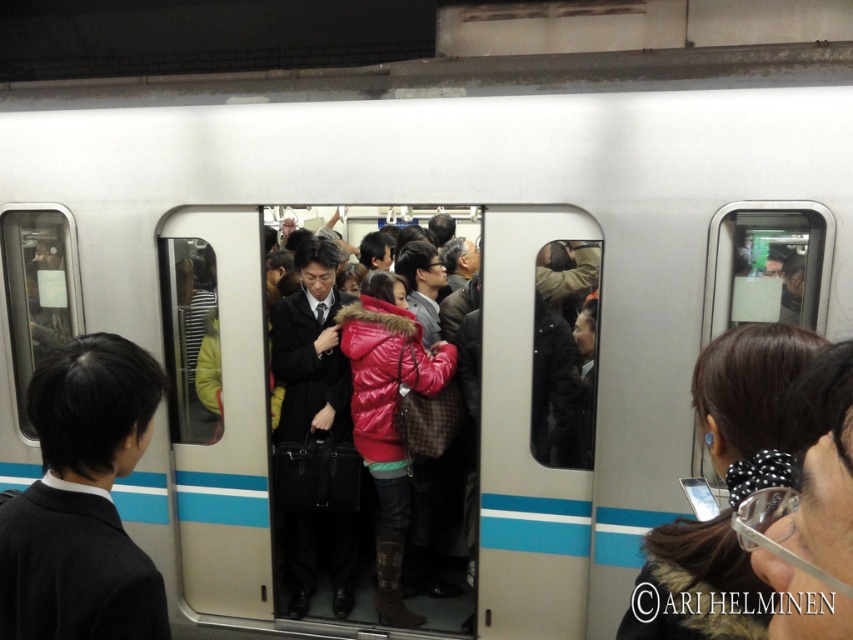
Can you confirm if shiny black jacket at center is positioned above shiny red jacket at center?

Correct, shiny black jacket at center is located above shiny red jacket at center.

Which is more to the right, shiny black jacket at center or shiny red jacket at center?

Positioned to the right is shiny black jacket at center.

Between point (647, 593) and point (395, 586), which one is positioned behind?

The point (395, 586) is behind.

The image size is (853, 640). What are the coordinates of `shiny black jacket at center` in the screenshot? It's located at (726, 488).

Is black matte sweater at left to the right of shiny red jacket at center from the viewer's perspective?

No, black matte sweater at left is not to the right of shiny red jacket at center.

Between black matte sweater at left and shiny red jacket at center, which one appears on the right side from the viewer's perspective?

Positioned to the right is shiny red jacket at center.

Where is `black matte sweater at left`? Image resolution: width=853 pixels, height=640 pixels. black matte sweater at left is located at coordinates (82, 500).

Find the location of a particular element. black matte sweater at left is located at coordinates (82, 500).

Does point (839, 628) come behind point (352, 328)?

No.

Who is more distant from viewer, (846, 592) or (358, 355)?

The point (358, 355) is more distant.

Locate an element on the screen. black textured hair at upper right is located at coordinates (810, 509).